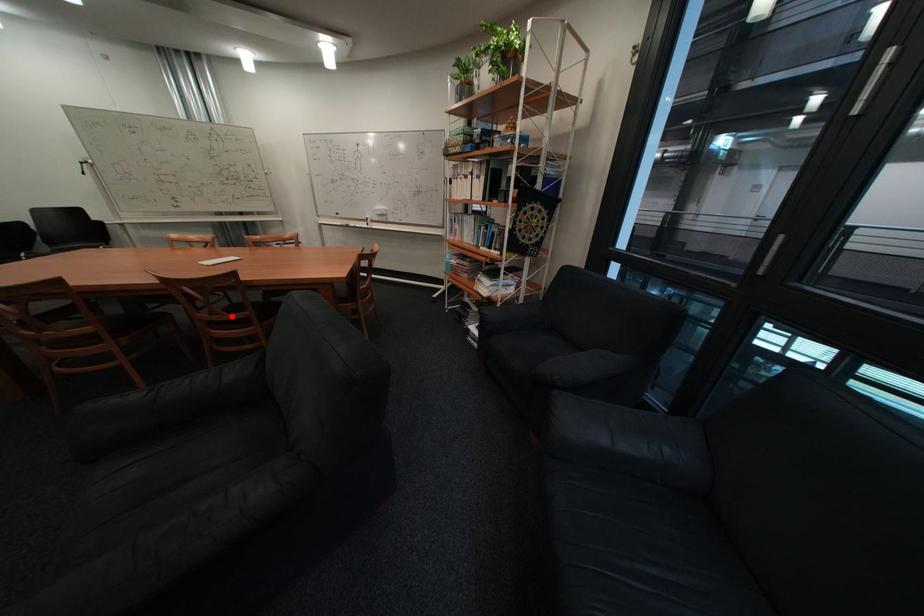
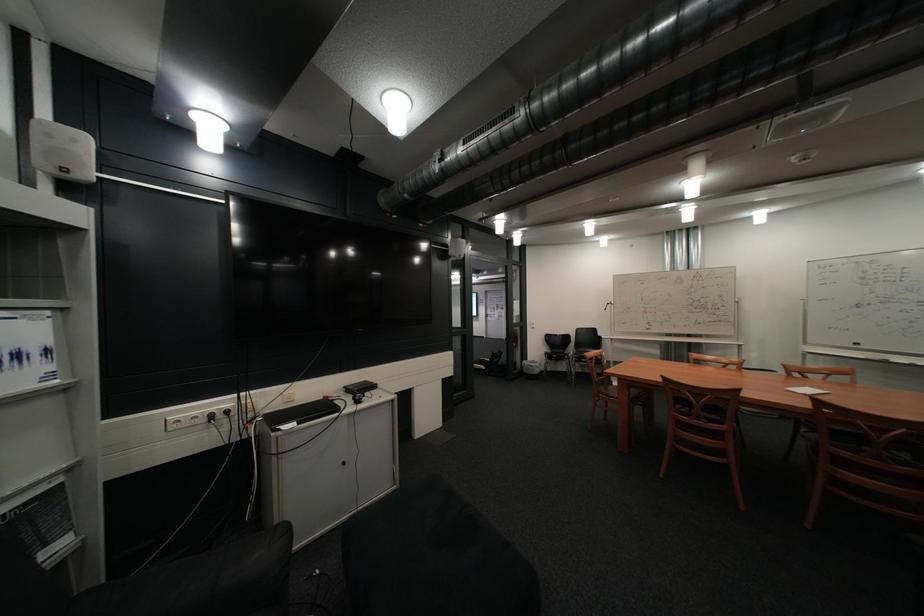
Question: I am providing you with two images of the same scene from different viewpoints. Given a red point in image1, look at the same physical point in image2. Is it:

Choices:
 (A) Closer to the viewpoint
 (B) Farther from the viewpoint

Answer: (A)